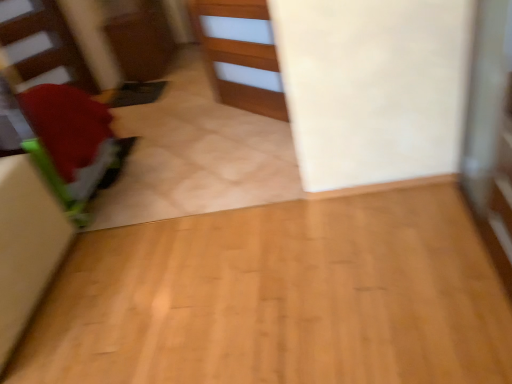
Locate an element on the screen. Image resolution: width=512 pixels, height=384 pixels. vacant area in front of wooden cabinet at center is located at coordinates (239, 160).